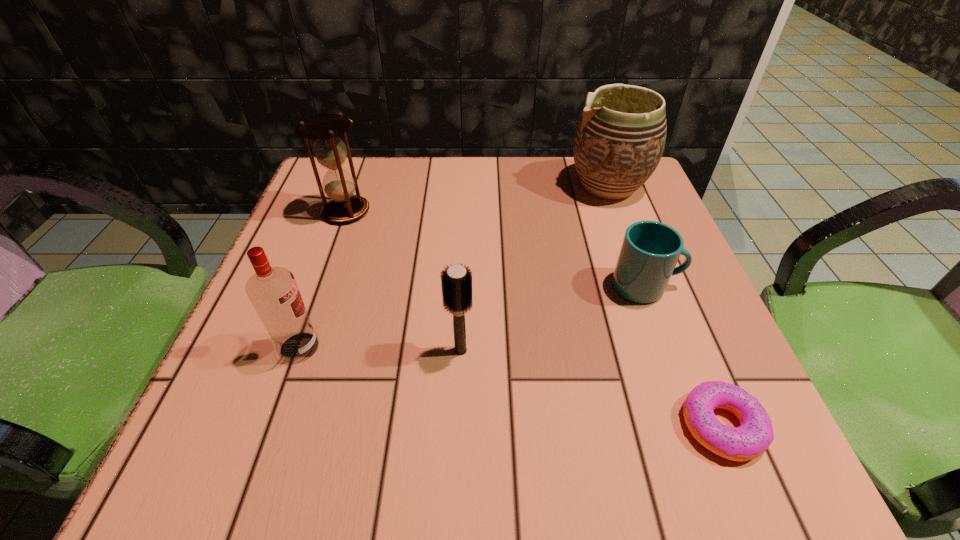
At what (x,y) coordinates should I click in order to perform the action: click on cup that is positioned at the right edge. Please return your answer as a coordinate pair (x, y). Looking at the image, I should click on (650, 250).

Find the location of `doughnut that is at the right edge`. doughnut that is at the right edge is located at coordinates (752, 438).

I want to click on object positioned at the far left corner, so click(x=330, y=151).

The height and width of the screenshot is (540, 960). In order to click on object positioned at the far right corner in this screenshot , I will do `click(619, 140)`.

Image resolution: width=960 pixels, height=540 pixels. Identify the location of object that is at the near right corner. (752, 438).

Locate an element on the screen. The image size is (960, 540). free location at the far edge is located at coordinates (541, 163).

This screenshot has width=960, height=540. Find the location of `free location at the near edge of the desktop`. free location at the near edge of the desktop is located at coordinates (329, 464).

Where is `vacant space at the left edge of the desktop`? vacant space at the left edge of the desktop is located at coordinates (252, 364).

You are a GUI agent. You are given a task and a screenshot of the screen. Output one action in this format:
    pyautogui.click(x=<x>, y=<y>)
    Task: Click on the free space at the far left corner
    The height and width of the screenshot is (540, 960).
    Given the screenshot: What is the action you would take?
    pyautogui.click(x=314, y=184)

I want to click on vacant space that's between the hairbrush and the cup, so coord(553,319).